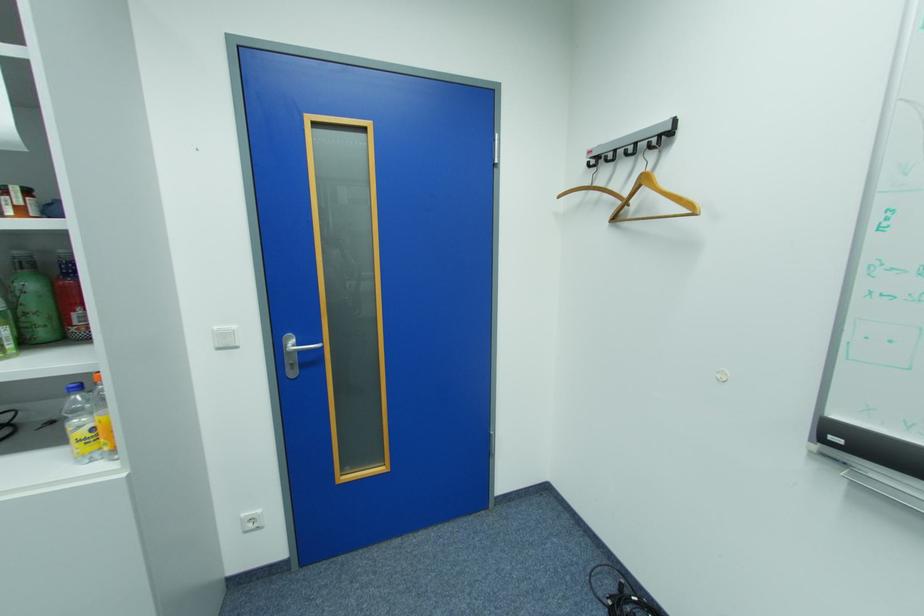
Describe the element at coordinates (308, 347) in the screenshot. I see `the silver door handle` at that location.